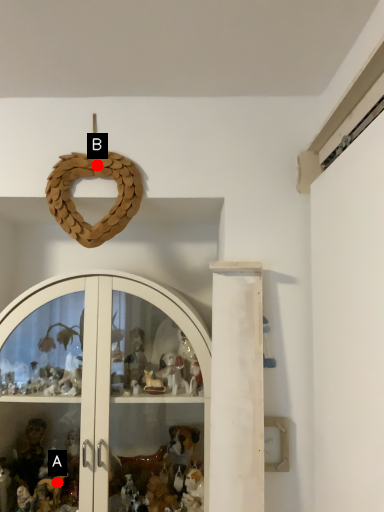
Question: Two points are circled on the image, labeled by A and B beside each circle. Which point is farther to the camera?

Choices:
 (A) A is further
 (B) B is further

Answer: (A)